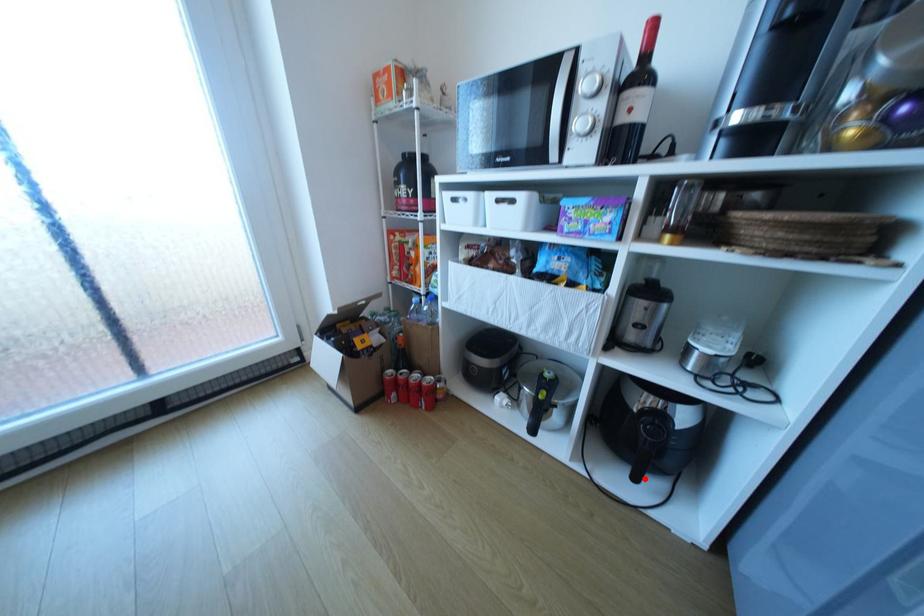
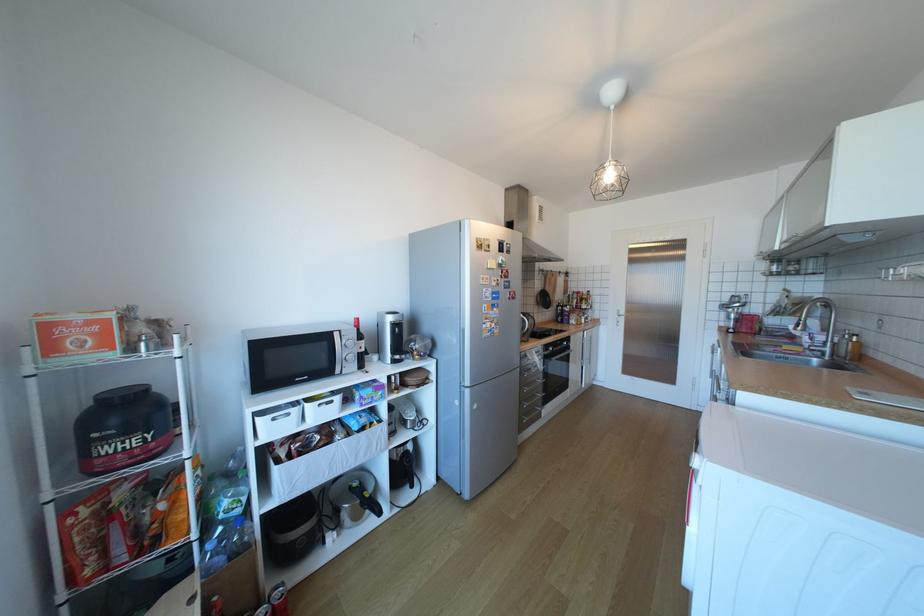
Find the pixel in the second image that matches the highlighted location in the first image.

(420, 485)